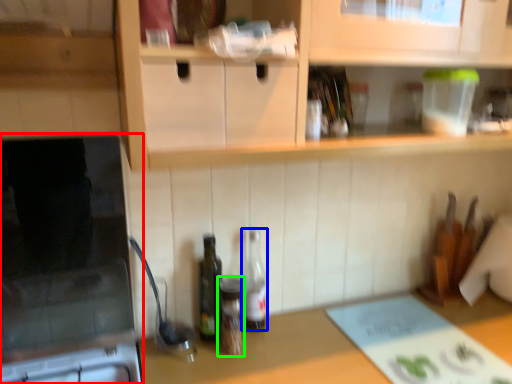
Question: Which is nearer to the appliance (highlighted by a red box)? bottle (highlighted by a blue box) or bottle (highlighted by a green box).

Choices:
 (A) bottle
 (B) bottle

Answer: (B)